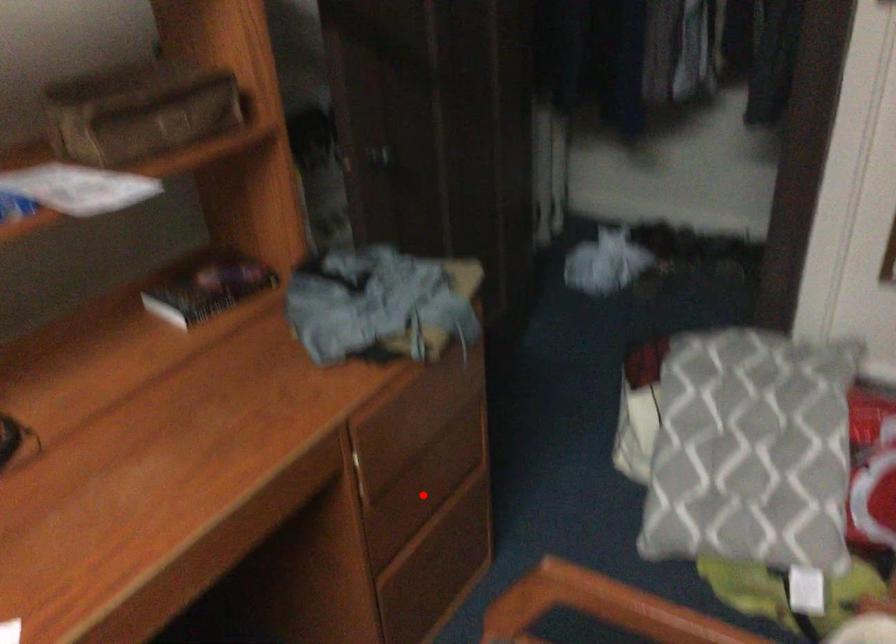
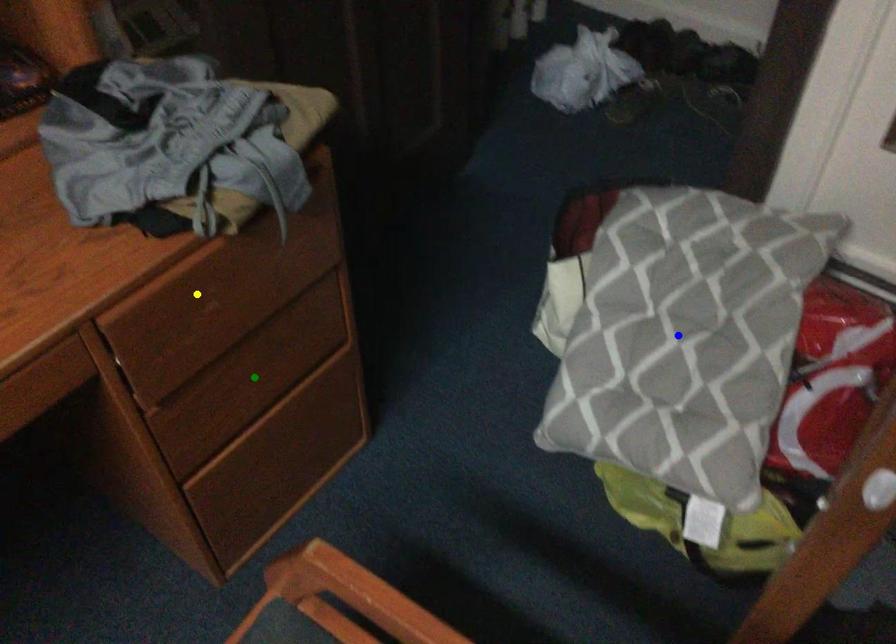
Question: I am providing you with two images of the same scene from different viewpoints. A red point is marked on the first image. You are given multiple points on the second image. Which point in image 2 represents the same 3d spot as the red point in image 1?

Choices:
 (A) yellow point
 (B) blue point
 (C) green point

Answer: (C)